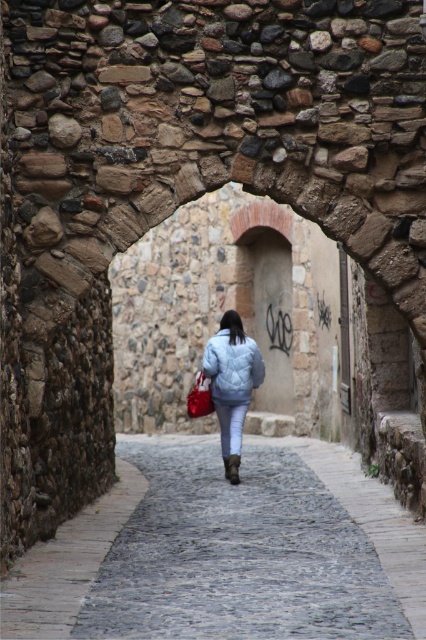
Question: Which point is farther from the camera taking this photo?

Choices:
 (A) (222, 387)
 (B) (218, 390)
 (C) (301, 598)

Answer: (B)

Question: Which object is farther from the camera taking this photo?

Choices:
 (A) cobblestone path at center
 (B) matte red shopping bag at center
 (C) light blue quilted jacket at center
 (D) matte blue jacket at center

Answer: (B)

Question: Does matte blue jacket at center appear on the right side of matte red shopping bag at center?

Choices:
 (A) no
 (B) yes

Answer: (B)

Question: Does cobblestone path at center appear on the left side of matte blue jacket at center?

Choices:
 (A) no
 (B) yes

Answer: (A)

Question: Is cobblestone path at center bigger than matte red shopping bag at center?

Choices:
 (A) no
 (B) yes

Answer: (B)

Question: Which of these objects is positioned closest to the matte red shopping bag at center?

Choices:
 (A) cobblestone path at center
 (B) light blue quilted jacket at center

Answer: (B)